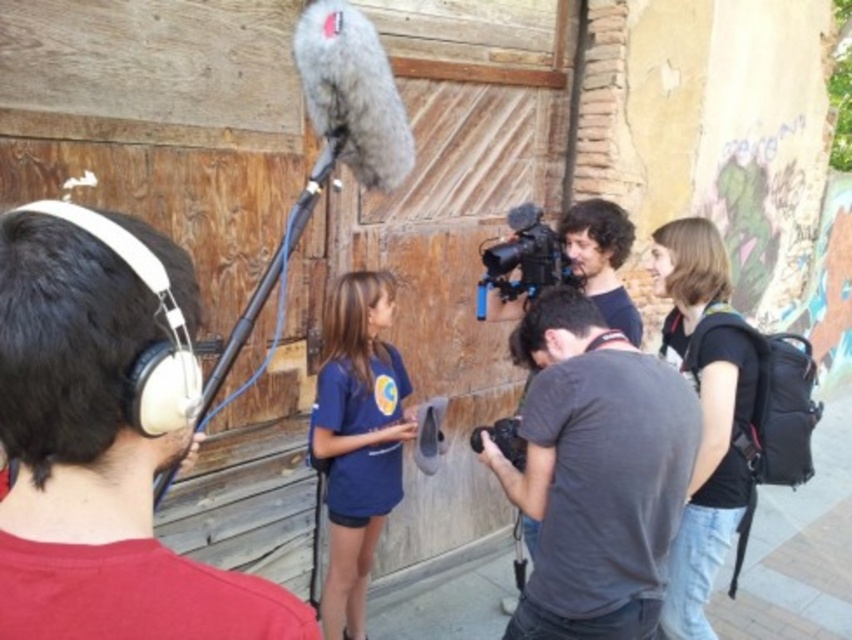
Identify the location of gray cotton t-shirt at center. The width and height of the screenshot is (852, 640). (596, 474).

I want to click on gray cotton t-shirt at center, so click(596, 474).

Locate an element on the screen. This screenshot has width=852, height=640. gray cotton t-shirt at center is located at coordinates (596, 474).

Find the location of a particular element. black fabric backpack at right is located at coordinates (703, 412).

Does point (718, 520) lie behind point (344, 364)?

No.

Between point (752, 388) and point (366, 282), which one is positioned in front?

Point (752, 388) is in front.

Find the location of a particular element. The height and width of the screenshot is (640, 852). black fabric backpack at right is located at coordinates (703, 412).

Can you confirm if matte black headphones at upper left is shorter than matte black microphone boom at upper center?

Yes.

Between point (240, 582) and point (154, 508), which one is positioned behind?

The point (154, 508) is behind.

Locate an element on the screen. The height and width of the screenshot is (640, 852). matte black headphones at upper left is located at coordinates (101, 444).